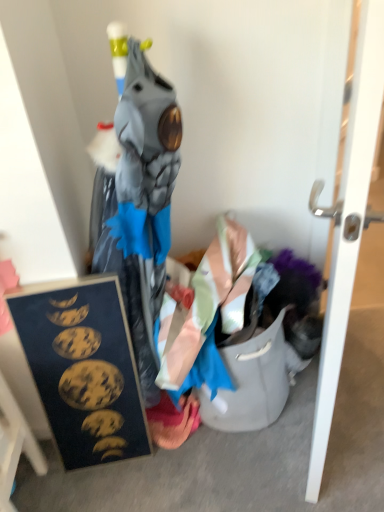
The image size is (384, 512). Identify the location of free space in front of pink fabric at lower center. (175, 471).